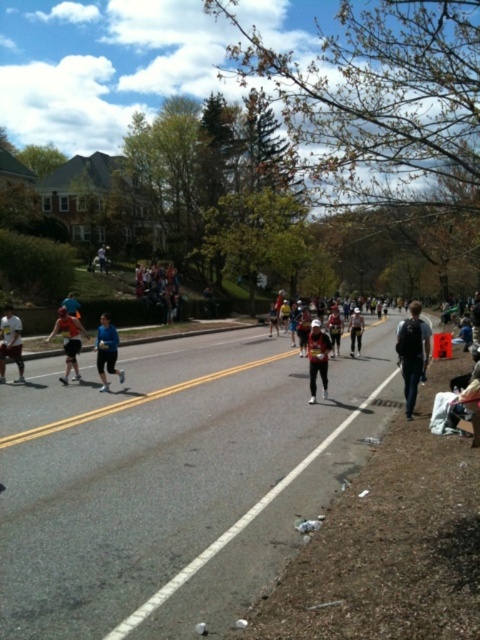
Measure the distance between matte black running outfit at center and camera.

matte black running outfit at center is 11.19 meters away from camera.

Between matte black running outfit at center and white athletic shorts at left, which one is positioned higher?

Positioned higher is white athletic shorts at left.

Between point (324, 358) and point (22, 365), which one is positioned behind?

Positioned behind is point (22, 365).

The height and width of the screenshot is (640, 480). I want to click on matte black running outfit at center, so click(317, 358).

Is the position of dark gray backpack at right more distant than that of white athletic shorts at left?

No, dark gray backpack at right is in front of white athletic shorts at left.

Can you confirm if dark gray backpack at right is positioned below white athletic shorts at left?

Indeed, dark gray backpack at right is positioned under white athletic shorts at left.

Locate an element on the screen. The width and height of the screenshot is (480, 640). dark gray backpack at right is located at coordinates (412, 353).

Is matte black running outfit at center positioned before white reflective vest at center?

Yes.

Between matte black running outfit at center and white reflective vest at center, which one has less height?

With less height is matte black running outfit at center.

Does point (311, 362) come closer to viewer compared to point (357, 346)?

That is True.

This screenshot has height=640, width=480. What are the coordinates of `matte black running outfit at center` in the screenshot? It's located at (317, 358).